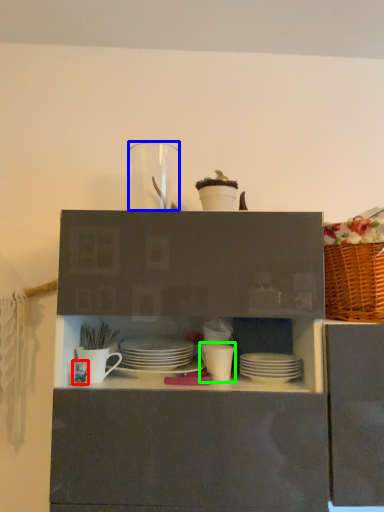
Question: Considering the real-world distances, which object is closest to tableware (highlighted by a red box)? tableware (highlighted by a blue box) or tableware (highlighted by a green box).

Choices:
 (A) tableware
 (B) tableware

Answer: (B)